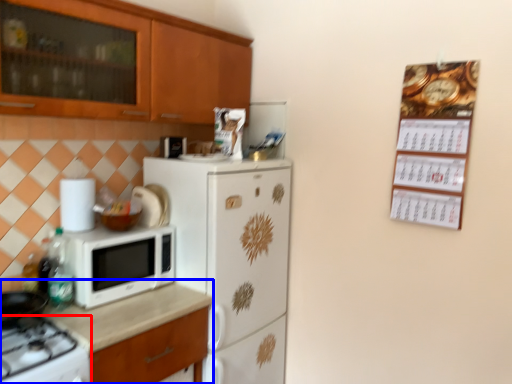
Question: Which point is further to the camera, gas stove (highlighted by a red box) or countertop (highlighted by a blue box)?

Choices:
 (A) gas stove
 (B) countertop

Answer: (B)